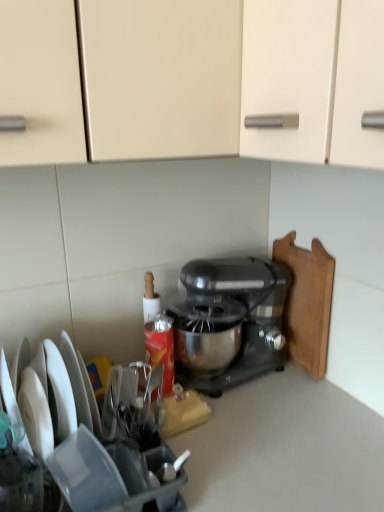
Question: Is satin black mixer at center facing towards wooden cutting board at right?

Choices:
 (A) yes
 (B) no

Answer: (B)

Question: From the image's perspective, is satin black mixer at center under wooden cutting board at right?

Choices:
 (A) yes
 (B) no

Answer: (A)

Question: From a real-world perspective, is satin black mixer at center located beneath wooden cutting board at right?

Choices:
 (A) no
 (B) yes

Answer: (B)

Question: Considering the relative sizes of satin black mixer at center and wooden cutting board at right in the image provided, is satin black mixer at center taller than wooden cutting board at right?

Choices:
 (A) yes
 (B) no

Answer: (B)

Question: Does satin black mixer at center appear on the right side of wooden cutting board at right?

Choices:
 (A) no
 (B) yes

Answer: (A)

Question: Is satin black mixer at center far away from wooden cutting board at right?

Choices:
 (A) no
 (B) yes

Answer: (A)

Question: From a real-world perspective, is metallic silver mixer at center on top of satin black mixer at center?

Choices:
 (A) no
 (B) yes

Answer: (B)

Question: Is satin black mixer at center completely or partially inside metallic silver mixer at center?

Choices:
 (A) yes
 (B) no

Answer: (B)

Question: Does metallic silver mixer at center have a lesser height compared to satin black mixer at center?

Choices:
 (A) yes
 (B) no

Answer: (B)

Question: Is the surface of metallic silver mixer at center in direct contact with satin black mixer at center?

Choices:
 (A) no
 (B) yes

Answer: (A)

Question: Is metallic silver mixer at center positioned beyond the bounds of satin black mixer at center?

Choices:
 (A) yes
 (B) no

Answer: (A)

Question: Would you say metallic silver mixer at center is a long distance from satin black mixer at center?

Choices:
 (A) no
 (B) yes

Answer: (A)

Question: Is metallic silver mixer at center outside of wooden cutting board at right?

Choices:
 (A) yes
 (B) no

Answer: (A)